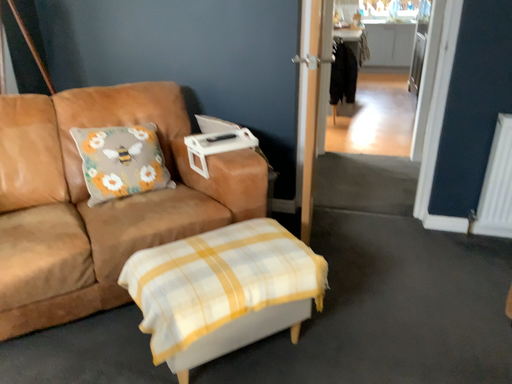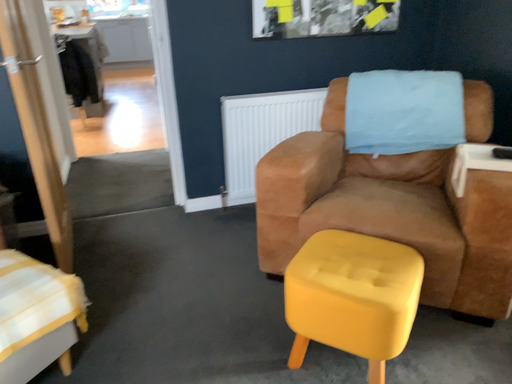
Question: Which way did the camera rotate in the video?

Choices:
 (A) rotated left
 (B) rotated right

Answer: (B)